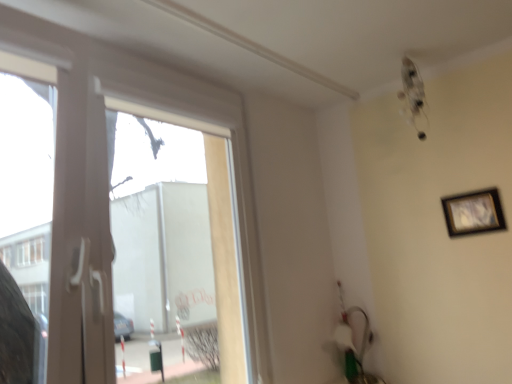
Question: Are transparent glass window at left and black matte picture frame at upper right located far from each other?

Choices:
 (A) no
 (B) yes

Answer: (B)

Question: Considering the relative sizes of transparent glass window at left and black matte picture frame at upper right in the image provided, is transparent glass window at left thinner than black matte picture frame at upper right?

Choices:
 (A) no
 (B) yes

Answer: (A)

Question: From the image's perspective, is transparent glass window at left on black matte picture frame at upper right?

Choices:
 (A) no
 (B) yes

Answer: (A)

Question: Does transparent glass window at left come behind black matte picture frame at upper right?

Choices:
 (A) yes
 (B) no

Answer: (B)

Question: Is transparent glass window at left not within black matte picture frame at upper right?

Choices:
 (A) no
 (B) yes

Answer: (B)

Question: Is transparent glass window at left at the right side of black matte picture frame at upper right?

Choices:
 (A) no
 (B) yes

Answer: (A)

Question: Is black matte picture frame at upper right bigger than transparent glass window at left?

Choices:
 (A) no
 (B) yes

Answer: (A)

Question: Can you confirm if black matte picture frame at upper right is taller than transparent glass window at left?

Choices:
 (A) yes
 (B) no

Answer: (B)

Question: Considering the relative positions of black matte picture frame at upper right and transparent glass window at left in the image provided, is black matte picture frame at upper right to the right of transparent glass window at left from the viewer's perspective?

Choices:
 (A) yes
 (B) no

Answer: (A)

Question: Is black matte picture frame at upper right further to camera compared to transparent glass window at left?

Choices:
 (A) no
 (B) yes

Answer: (B)

Question: Are black matte picture frame at upper right and transparent glass window at left far apart?

Choices:
 (A) no
 (B) yes

Answer: (B)

Question: Can you confirm if black matte picture frame at upper right is shorter than transparent glass window at left?

Choices:
 (A) no
 (B) yes

Answer: (B)

Question: Do you think transparent glass window at left is within black matte picture frame at upper right, or outside of it?

Choices:
 (A) inside
 (B) outside

Answer: (B)